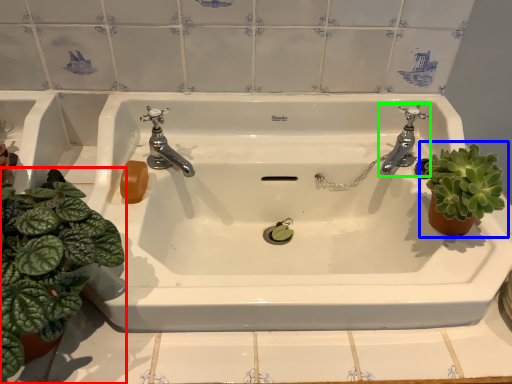
Question: Based on their relative distances, which object is farther from houseplant (highlighted by a red box)? Choose from houseplant (highlighted by a blue box) and tap (highlighted by a green box).

Choices:
 (A) houseplant
 (B) tap

Answer: (B)